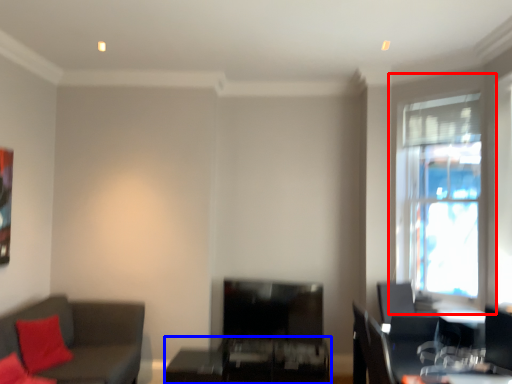
Question: Among these objects, which one is nearest to the camera, window (highlighted by a red box) or table (highlighted by a blue box)?

Choices:
 (A) window
 (B) table

Answer: (A)